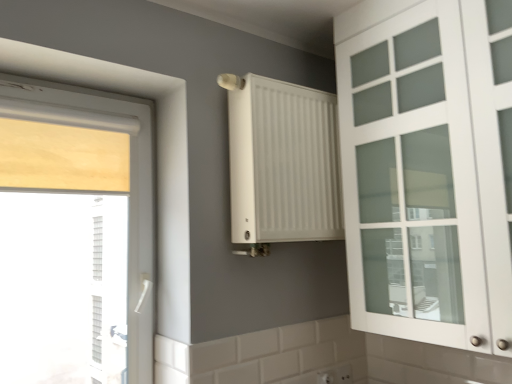
This screenshot has width=512, height=384. Describe the element at coordinates (343, 374) in the screenshot. I see `white plastic electric outlet at lower center` at that location.

Locate an element on the screen. wooden blind at left is located at coordinates (74, 236).

Does point (411, 311) come in front of point (50, 338)?

Yes.

From the image's perspective, is white matte cabinet at right above wooden blind at left?

Correct, white matte cabinet at right appears higher than wooden blind at left in the image.

In terms of size, does white matte cabinet at right appear bigger or smaller than wooden blind at left?

Clearly, white matte cabinet at right is larger in size than wooden blind at left.

Is white matte cabinet at right surrounding wooden blind at left?

No.

Which is nearer, [291,233] or [92,377]?

Point [291,233].

Consider the image. Measure the distance from white matte radiator at center to wooden blind at left.

A distance of 5.61 feet exists between white matte radiator at center and wooden blind at left.

Which object is wider, white matte radiator at center or wooden blind at left?

white matte radiator at center is wider.

From the image's perspective, would you say white matte radiator at center is shown under wooden blind at left?

No.

Can you confirm if white plastic electric outlet at lower center is taller than white matte cabinet at right?

No, white plastic electric outlet at lower center is not taller than white matte cabinet at right.

From a real-world perspective, is white plastic electric outlet at lower center positioned above or below white matte cabinet at right?

white plastic electric outlet at lower center is situated lower than white matte cabinet at right in the real world.

Can you confirm if white plastic electric outlet at lower center is positioned to the right of white matte cabinet at right?

Incorrect, white plastic electric outlet at lower center is not on the right side of white matte cabinet at right.

Which object is wider, white plastic electric outlet at lower center or white matte cabinet at right?

white matte cabinet at right is wider.

Is white plastic electric outlet at lower center located within wooden blind at left?

No.

Considering the sizes of objects wooden blind at left and white plastic electric outlet at lower center in the image provided, who is wider, wooden blind at left or white plastic electric outlet at lower center?

wooden blind at left.

Could you tell me if wooden blind at left is facing white plastic electric outlet at lower center?

No, wooden blind at left is not aimed at white plastic electric outlet at lower center.

In terms of size, does wooden blind at left appear bigger or smaller than white plastic electric outlet at lower center?

In the image, wooden blind at left appears to be larger than white plastic electric outlet at lower center.

At what (x,y) coordinates should I click in order to perform the action: click on radiator on the left of white plastic electric outlet at lower center. Please return your answer as a coordinate pair (x, y). Looking at the image, I should click on (283, 164).

Is white matte radiator at center outside of white plastic electric outlet at lower center?

Yes, white matte radiator at center is located beyond the bounds of white plastic electric outlet at lower center.

Does white matte radiator at center have a larger size compared to white plastic electric outlet at lower center?

Yes.

Based on the photo, from the image's perspective, who appears lower, white matte radiator at center or white plastic electric outlet at lower center?

white plastic electric outlet at lower center, from the image's perspective.

From a real-world perspective, between white plastic electric outlet at lower center and white matte radiator at center, who is vertically higher?

From a 3D spatial view, white matte radiator at center is above.

Is white plastic electric outlet at lower center taller or shorter than white matte radiator at center?

white plastic electric outlet at lower center is shorter than white matte radiator at center.

How far apart are white plastic electric outlet at lower center and white matte radiator at center?

white plastic electric outlet at lower center is 37.38 inches away from white matte radiator at center.

Considering the sizes of objects white matte cabinet at right and white plastic electric outlet at lower center in the image provided, who is smaller, white matte cabinet at right or white plastic electric outlet at lower center?

white plastic electric outlet at lower center.

Is white matte cabinet at right placed right next to white plastic electric outlet at lower center?

There is a gap between white matte cabinet at right and white plastic electric outlet at lower center.

Is white plastic electric outlet at lower center surrounded by white matte cabinet at right?

No, white plastic electric outlet at lower center is not a part of white matte cabinet at right.

Considering the relative sizes of white matte cabinet at right and white plastic electric outlet at lower center in the image provided, is white matte cabinet at right taller than white plastic electric outlet at lower center?

Correct, white matte cabinet at right is much taller as white plastic electric outlet at lower center.

Where is `window beneath the white matte cabinet at right (from a real-world perspective)`? The width and height of the screenshot is (512, 384). window beneath the white matte cabinet at right (from a real-world perspective) is located at coordinates tap(74, 236).

The height and width of the screenshot is (384, 512). I want to click on radiator located above the wooden blind at left (from the image's perspective), so click(283, 164).

In the scene shown: When comparing their distances from white matte cabinet at right, does white plastic electric outlet at lower center or wooden blind at left seem closer?

Among the two, white plastic electric outlet at lower center is located nearer to white matte cabinet at right.

Estimate the real-world distances between objects in this image. Which object is further from wooden blind at left, white matte radiator at center or white plastic electric outlet at lower center?

Based on the image, white plastic electric outlet at lower center appears to be further to wooden blind at left.

Based on their spatial positions, is wooden blind at left or white matte radiator at center closer to white matte cabinet at right?

Among the two, white matte radiator at center is located nearer to white matte cabinet at right.

Considering their positions, is white matte radiator at center positioned closer to white matte cabinet at right than wooden blind at left?

white matte radiator at center.

Looking at the image, which one is located further to wooden blind at left, white plastic electric outlet at lower center or white matte radiator at center?

white plastic electric outlet at lower center lies further to wooden blind at left than the other object.

Considering their positions, is wooden blind at left positioned further to white matte radiator at center than white plastic electric outlet at lower center?

The object further to white matte radiator at center is wooden blind at left.

Which object lies further to the anchor point white matte radiator at center, white matte cabinet at right or white plastic electric outlet at lower center?

white plastic electric outlet at lower center.

When comparing their distances from white matte cabinet at right, does white plastic electric outlet at lower center or white matte radiator at center seem closer?

Based on the image, white matte radiator at center appears to be nearer to white matte cabinet at right.

This screenshot has width=512, height=384. In order to click on radiator between wooden blind at left and white plastic electric outlet at lower center from left to right in this screenshot , I will do `click(283, 164)`.

Where is `electric outlet between wooden blind at left and white matte cabinet at right`? Image resolution: width=512 pixels, height=384 pixels. electric outlet between wooden blind at left and white matte cabinet at right is located at coordinates (343, 374).

You are a GUI agent. You are given a task and a screenshot of the screen. Output one action in this format:
    pyautogui.click(x=<x>, y=<y>)
    Task: Click on the radiator between wooden blind at left and white matte cabinet at right from left to right
    This screenshot has width=512, height=384.
    Given the screenshot: What is the action you would take?
    pyautogui.click(x=283, y=164)

Where is `radiator between white matte cabinet at right and white plastic electric outlet at lower center from top to bottom`? Image resolution: width=512 pixels, height=384 pixels. radiator between white matte cabinet at right and white plastic electric outlet at lower center from top to bottom is located at coordinates (283, 164).